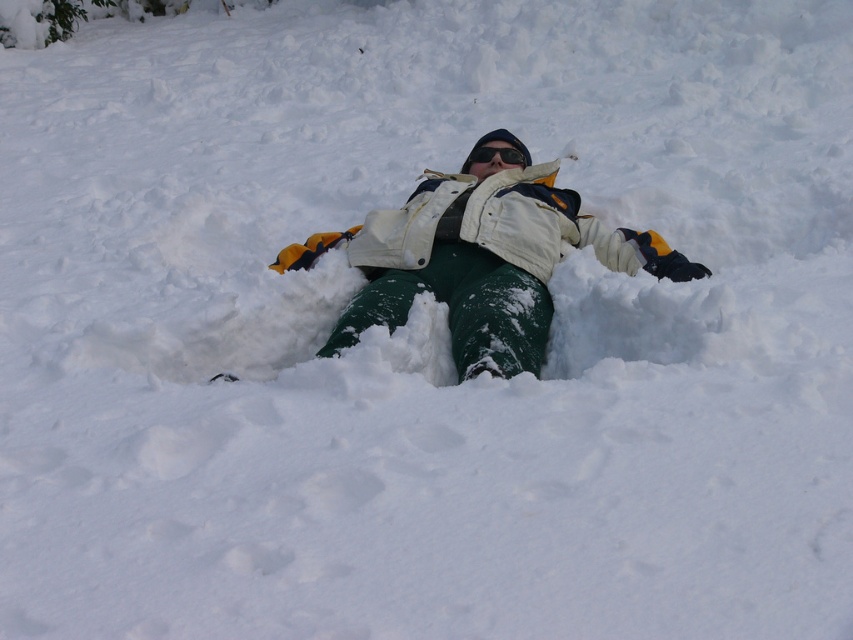
Is white fleece jacket at center positioned in front of black reflective goggles at center?

That is True.

Image resolution: width=853 pixels, height=640 pixels. What do you see at coordinates (480, 259) in the screenshot?
I see `white fleece jacket at center` at bounding box center [480, 259].

At what (x,y) coordinates should I click in order to perform the action: click on white fleece jacket at center. Please return your answer as a coordinate pair (x, y). Looking at the image, I should click on (480, 259).